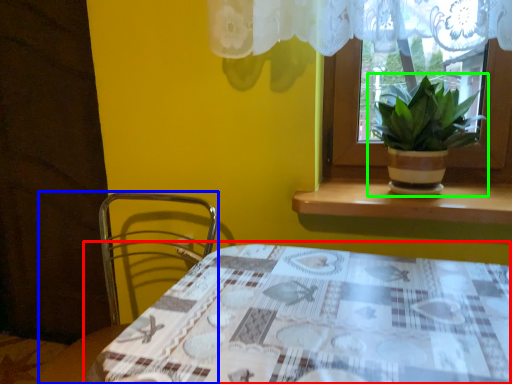
Question: Which is nearer to the table (highlighted by a red box)? chair (highlighted by a blue box) or houseplant (highlighted by a green box).

Choices:
 (A) chair
 (B) houseplant

Answer: (B)